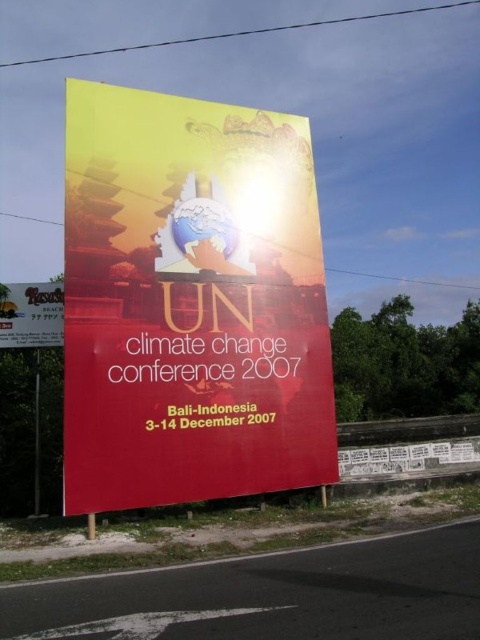
Who is lower down, matte yellow poster at center or yellow matte signboard at upper center?

matte yellow poster at center is lower down.

Locate an element on the screen. The width and height of the screenshot is (480, 640). matte yellow poster at center is located at coordinates (191, 301).